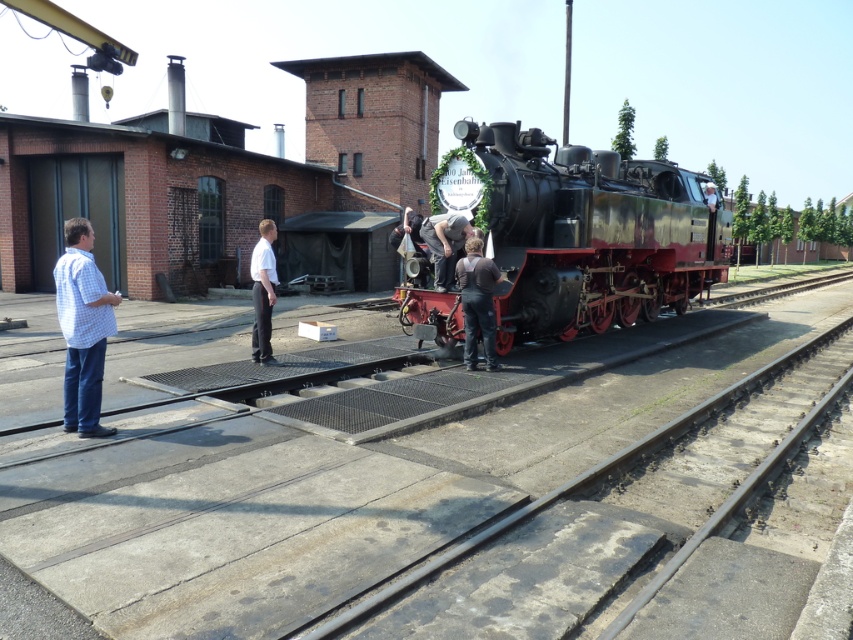
You are a train enthusiast standing at the railway station depicted in the scene. You notice a shiny black locomotive at center. Where exactly is this locomotive located in relation to the point marked at coordinates (583, 230)?

The shiny black locomotive at center is located exactly at the point marked at coordinates (583, 230).

You are standing at the point labeled as point (450, 259) and want to walk to the point labeled as point (84, 339). Which direction should you move relative to the brick building with the chimney?

You should move towards the front of the brick building with the chimney because point (84, 339) is in front of point (450, 259).